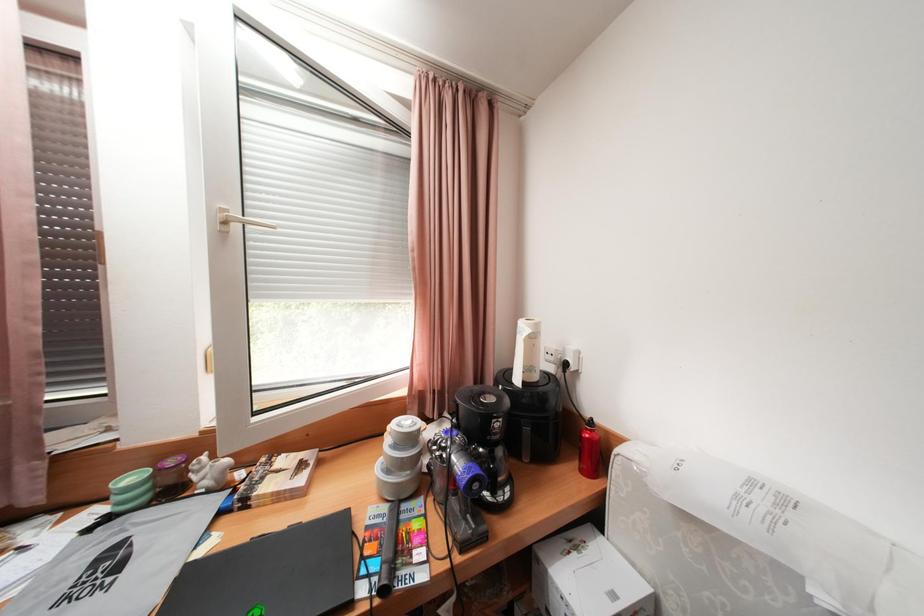
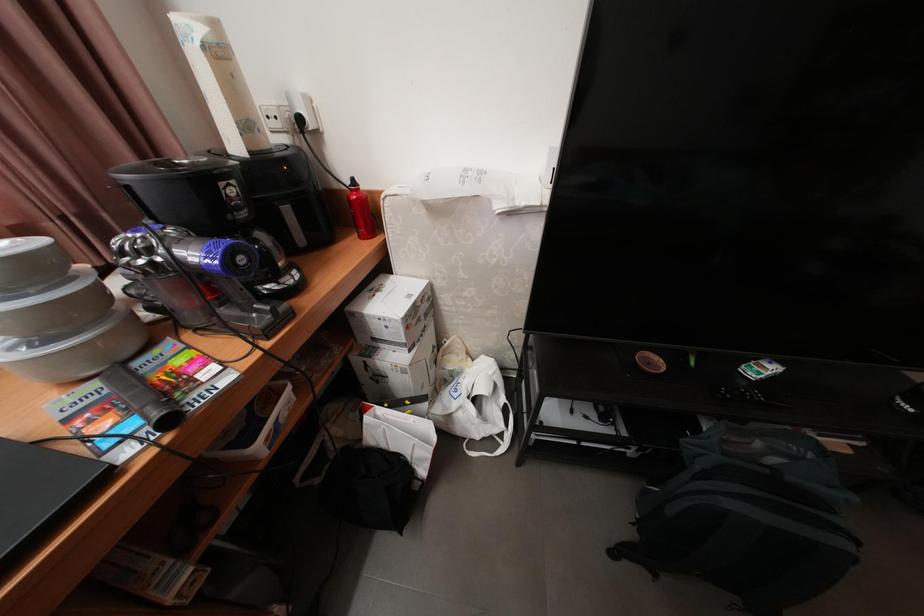
The images are taken continuously from a first-person perspective. In which direction is your viewpoint rotating?

The rotation direction of the camera is right-down.